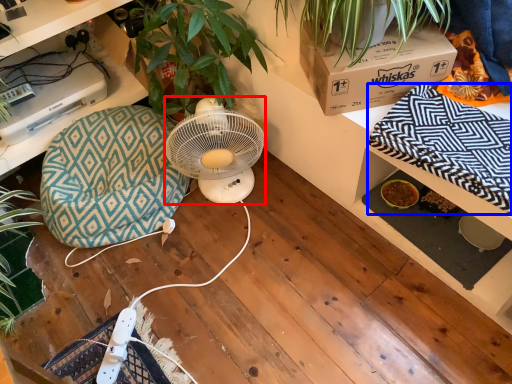
Question: Which object appears closest to the camera in this image, mechanical fan (highlighted by a red box) or blanket (highlighted by a blue box)?

Choices:
 (A) mechanical fan
 (B) blanket

Answer: (B)